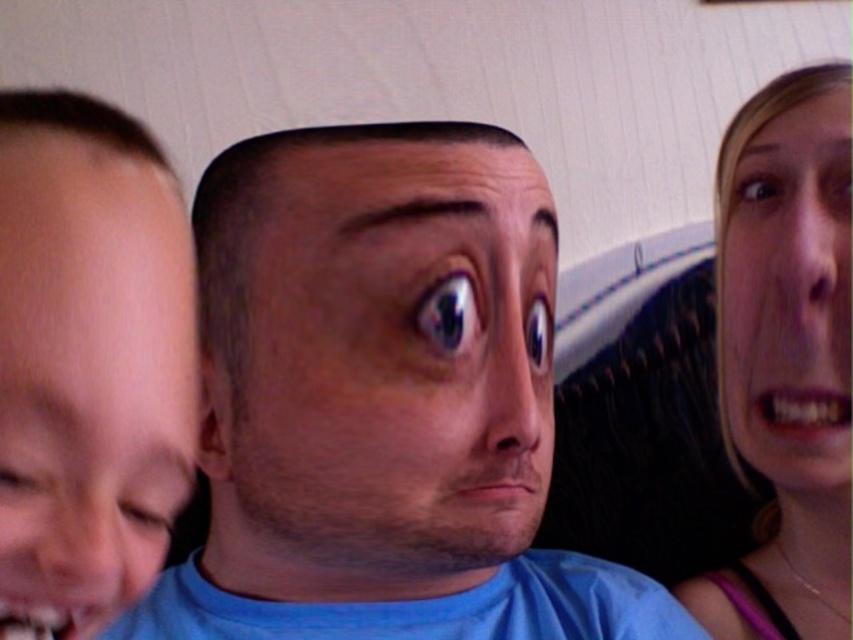
You are a photographer trying to capture a group photo of the brown matte face at center and the blonde hair at right. If you want to ensure both subjects are framed equally in the photo, which subject should you adjust the camera angle to focus more on?

The brown matte face at center is wider than the blonde hair at right, so you should focus more on the blonde hair at right to balance their widths in the frame.

Based on the scene description, which face has a wider appearance between the blue matte face at center and the smooth skin face at left?

The blue matte face at center is wider than the smooth skin face at left according to the description.

In the scene shown: You are standing in front of the three people in the image. You want to throw a small ball to the point closer to you between point (x=508, y=449) and point (x=817, y=285). Which point should you aim for?

You should aim for point (x=508, y=449) because it is closer to the viewer than point (x=817, y=285).